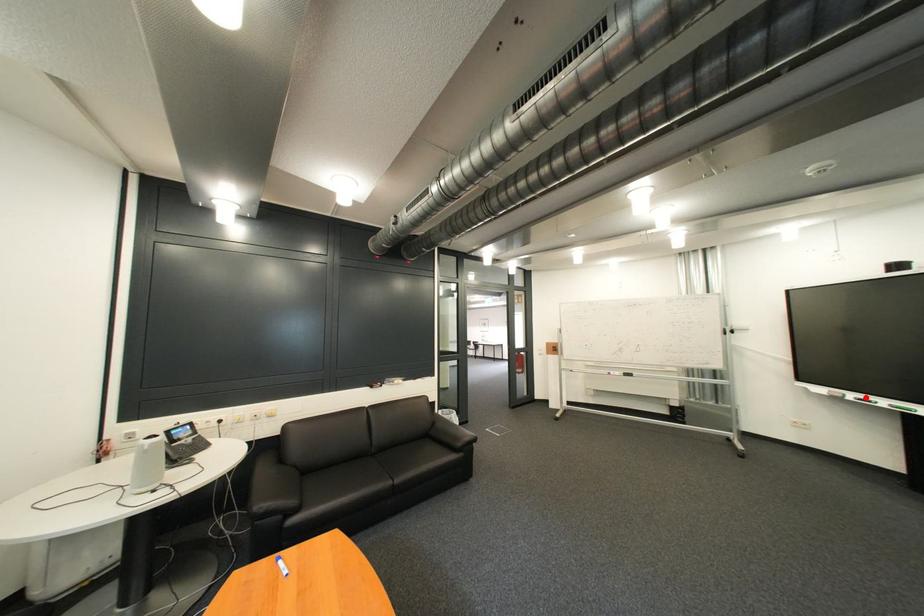
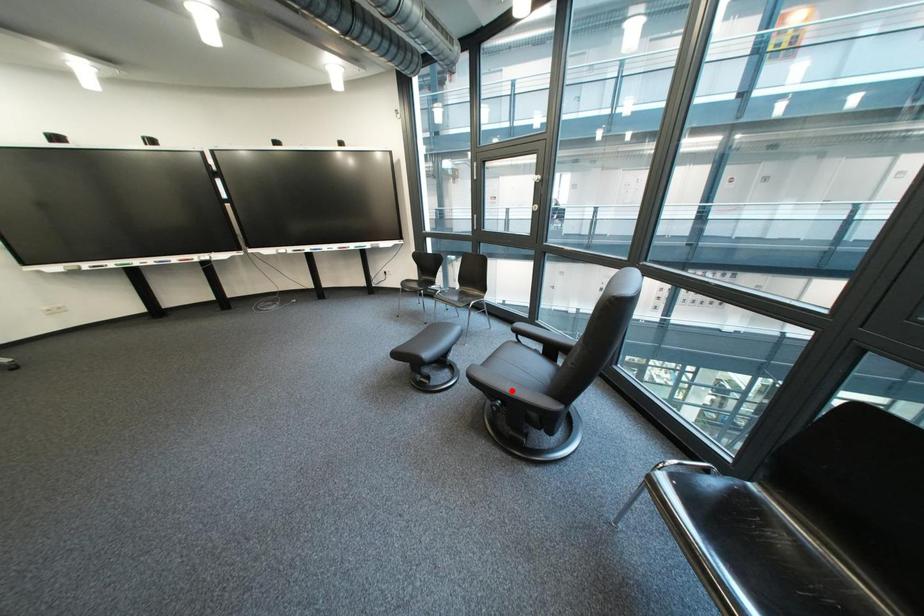
I am providing you with two images of the same scene from different viewpoints. A red point is marked on the first image and another point is marked on the second image. Does the point marked in image1 correspond to the same location as the one in image2?

No